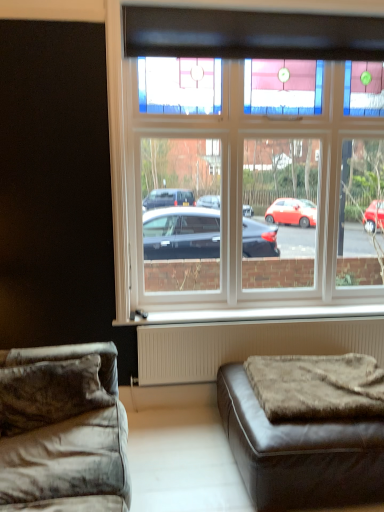
Question: From a real-world perspective, is brown fuzzy mattress at lower right over velvet gray couch at lower left, which ranks as the first studio couch in left-to-right order?

Choices:
 (A) yes
 (B) no

Answer: (A)

Question: Can you confirm if brown fuzzy mattress at lower right is bigger than velvet gray couch at lower left, the 2th studio couch when ordered from right to left?

Choices:
 (A) no
 (B) yes

Answer: (A)

Question: Is brown fuzzy mattress at lower right touching velvet gray couch at lower left, which ranks as the first studio couch in left-to-right order?

Choices:
 (A) no
 (B) yes

Answer: (A)

Question: Can you confirm if brown fuzzy mattress at lower right is positioned to the left of velvet gray couch at lower left, which ranks as the first studio couch in left-to-right order?

Choices:
 (A) yes
 (B) no

Answer: (B)

Question: Does brown fuzzy mattress at lower right have a lesser height compared to velvet gray couch at lower left, the 2th studio couch when ordered from right to left?

Choices:
 (A) yes
 (B) no

Answer: (A)

Question: Choose the correct answer: Is velvet gray couch at lower left, the 2th studio couch when ordered from right to left, inside brown leather ottoman at lower right, positioned as the first studio couch in right-to-left order, or outside it?

Choices:
 (A) inside
 (B) outside

Answer: (B)

Question: Considering their positions, is velvet gray couch at lower left, the 2th studio couch when ordered from right to left, located in front of or behind brown leather ottoman at lower right, positioned as the first studio couch in right-to-left order?

Choices:
 (A) front
 (B) behind

Answer: (A)

Question: Does point (109, 365) appear closer or farther from the camera than point (304, 463)?

Choices:
 (A) closer
 (B) farther

Answer: (B)

Question: From the image's perspective, is velvet gray couch at lower left, which ranks as the first studio couch in left-to-right order, above or below brown leather ottoman at lower right, the second studio couch from the left?

Choices:
 (A) below
 (B) above

Answer: (B)

Question: Looking at the image, does white plastic window sill at lower center seem bigger or smaller compared to clear glass window at upper center?

Choices:
 (A) big
 (B) small

Answer: (B)

Question: From a real-world perspective, relative to clear glass window at upper center, is white plastic window sill at lower center vertically above or below?

Choices:
 (A) above
 (B) below

Answer: (B)

Question: In terms of width, does white plastic window sill at lower center look wider or thinner when compared to clear glass window at upper center?

Choices:
 (A) thin
 (B) wide

Answer: (B)

Question: Considering the positions of white plastic window sill at lower center and clear glass window at upper center in the image, is white plastic window sill at lower center taller or shorter than clear glass window at upper center?

Choices:
 (A) short
 (B) tall

Answer: (A)

Question: In the image, is white plastic window sill at lower center positioned in front of or behind velvet gray couch at lower left, the 2th studio couch when ordered from right to left?

Choices:
 (A) behind
 (B) front

Answer: (A)

Question: From their relative heights in the image, would you say white plastic window sill at lower center is taller or shorter than velvet gray couch at lower left, which ranks as the first studio couch in left-to-right order?

Choices:
 (A) tall
 (B) short

Answer: (B)